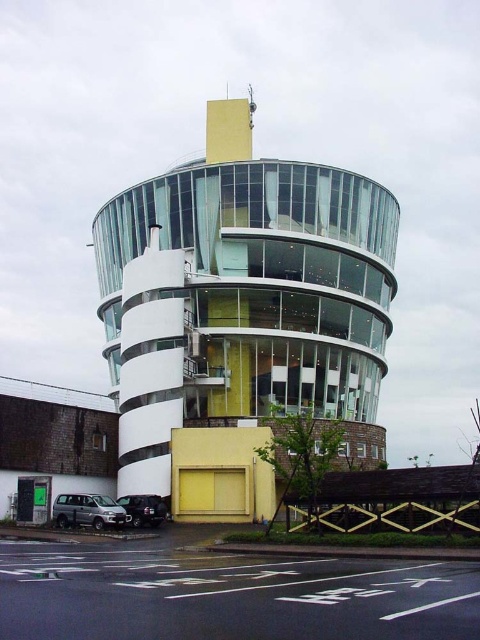
Question: Can you confirm if transparent glass tower at center is positioned below silver metallic van at lower left?

Choices:
 (A) yes
 (B) no

Answer: (B)

Question: Can you confirm if transparent glass tower at center is positioned to the right of shiny black suv at lower left?

Choices:
 (A) yes
 (B) no

Answer: (A)

Question: Is transparent glass tower at center smaller than silver metallic van at lower left?

Choices:
 (A) yes
 (B) no

Answer: (B)

Question: Which object is closer to the camera taking this photo?

Choices:
 (A) silver metallic van at lower left
 (B) shiny black suv at lower left

Answer: (A)

Question: Which object appears farthest from the camera in this image?

Choices:
 (A) shiny black suv at lower left
 (B) silver metallic van at lower left

Answer: (A)

Question: Which point is closer to the camera taking this photo?

Choices:
 (A) (365, 241)
 (B) (90, 515)

Answer: (B)